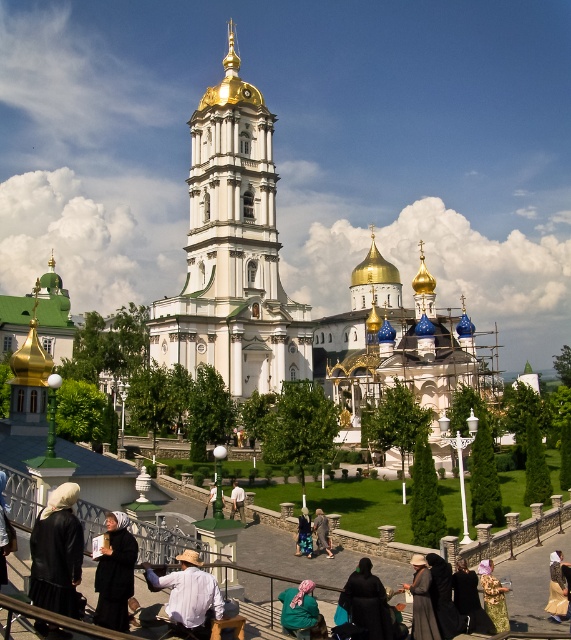
Question: Among these points, which one is nearest to the camera?

Choices:
 (A) (186, 620)
 (B) (315, 602)
 (C) (324, 547)
 (D) (307, 552)

Answer: (A)

Question: Can you confirm if black wool coat at lower left is bigger than black fabric headscarf at lower center?

Choices:
 (A) no
 (B) yes

Answer: (B)

Question: From the image, what is the correct spatial relationship of light brown fabric dress at center in relation to light brown leather jacket at center?

Choices:
 (A) below
 (B) above

Answer: (A)

Question: Based on their relative distances, which object is nearer to the dark brown leather jacket at lower center?

Choices:
 (A) white cotton shirt at lower center
 (B) blue denim jacket at center
 (C) light brown fabric dress at lower right
 (D) black wool coat at lower left

Answer: (C)

Question: Does black fabric headscarf at lower left have a lesser width compared to black wool coat at lower left?

Choices:
 (A) no
 (B) yes

Answer: (A)

Question: Which point is farther from the camera taking this photo?

Choices:
 (A) (219, 339)
 (B) (182, 362)

Answer: (A)